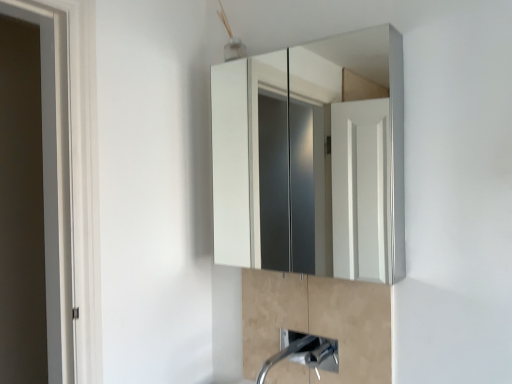
Describe the element at coordinates (304, 353) in the screenshot. I see `satin nickel faucet at lower center` at that location.

Locate an element on the screen. The height and width of the screenshot is (384, 512). satin nickel faucet at lower center is located at coordinates (304, 353).

What is the approximate height of satin nickel faucet at lower center?

The height of satin nickel faucet at lower center is 14.05 inches.

Image resolution: width=512 pixels, height=384 pixels. I want to click on satin nickel faucet at lower center, so click(x=304, y=353).

You are a GUI agent. You are given a task and a screenshot of the screen. Output one action in this format:
    pyautogui.click(x=<x>, y=<y>)
    Task: Click on the plumbing fixture lying below the white glossy medicine cabinet at upper center (from the image's perspective)
    This screenshot has width=512, height=384.
    Given the screenshot: What is the action you would take?
    pyautogui.click(x=304, y=353)

Is white glossy medicine cabinet at upper center oriented away from satin nickel faucet at lower center?

No, white glossy medicine cabinet at upper center's orientation is not away from satin nickel faucet at lower center.

Is point (355, 234) closer or farther from the camera than point (329, 358)?

Point (355, 234).

Do you think white glossy medicine cabinet at upper center is within satin nickel faucet at lower center, or outside of it?

white glossy medicine cabinet at upper center is outside satin nickel faucet at lower center.

Who is shorter, satin nickel faucet at lower center or white glossy medicine cabinet at upper center?

Standing shorter between the two is satin nickel faucet at lower center.

Identify the location of medicine cabinet above the satin nickel faucet at lower center (from the image's perspective). This screenshot has width=512, height=384. (311, 159).

Who is bigger, satin nickel faucet at lower center or white glossy medicine cabinet at upper center?

white glossy medicine cabinet at upper center is bigger.

From the image's perspective, who appears lower, satin nickel faucet at lower center or white glossy medicine cabinet at upper center?

From the image's view, satin nickel faucet at lower center is below.

Is satin nickel faucet at lower center to the left of satin nickel faucet at lower center from the viewer's perspective?

Indeed, satin nickel faucet at lower center is positioned on the left side of satin nickel faucet at lower center.

Does satin nickel faucet at lower center contain satin nickel faucet at lower center?

No.

Could you tell me if satin nickel faucet at lower center is facing satin nickel faucet at lower center?

No, satin nickel faucet at lower center is not turned towards satin nickel faucet at lower center.

Considering the sizes of satin nickel faucet at lower center and satin nickel faucet at lower center in the image, is satin nickel faucet at lower center bigger or smaller than satin nickel faucet at lower center?

Considering their sizes, satin nickel faucet at lower center takes up more space than satin nickel faucet at lower center.

Based on the photo, is satin nickel faucet at lower center bigger than satin nickel faucet at lower center?

Incorrect, satin nickel faucet at lower center is not larger than satin nickel faucet at lower center.

From the image's perspective, is satin nickel faucet at lower center positioned above or below satin nickel faucet at lower center?

Based on their image positions, satin nickel faucet at lower center is located above satin nickel faucet at lower center.

How far apart are satin nickel faucet at lower center and satin nickel faucet at lower center?

A distance of 3.28 inches exists between satin nickel faucet at lower center and satin nickel faucet at lower center.

Are satin nickel faucet at lower center and satin nickel faucet at lower center beside each other?

Yes, satin nickel faucet at lower center is touching satin nickel faucet at lower center.

Measure the distance from satin nickel faucet at lower center to white glossy medicine cabinet at upper center.

satin nickel faucet at lower center is 25.97 inches away from white glossy medicine cabinet at upper center.

Which point is more distant from viewer, (248, 273) or (269, 170)?

The point (269, 170) is farther.

Can you see satin nickel faucet at lower center touching white glossy medicine cabinet at upper center?

They are not placed beside each other.

Between satin nickel faucet at lower center and white glossy medicine cabinet at upper center, which one has smaller size?

Smaller between the two is satin nickel faucet at lower center.

Between white glossy medicine cabinet at upper center and satin nickel faucet at lower center, which one has less height?

satin nickel faucet at lower center.

From a real-world perspective, which is physically below, white glossy medicine cabinet at upper center or satin nickel faucet at lower center?

In real-world perspective, satin nickel faucet at lower center is lower.

From the image's perspective, which object appears higher, white glossy medicine cabinet at upper center or satin nickel faucet at lower center?

white glossy medicine cabinet at upper center appears higher in the image.

Could you measure the distance between white glossy medicine cabinet at upper center and satin nickel faucet at lower center?

They are 65.97 centimeters apart.

Locate an element on the screen. The width and height of the screenshot is (512, 384). medicine cabinet in front of the satin nickel faucet at lower center is located at coordinates (311, 159).

Identify the location of plumbing fixture below the white glossy medicine cabinet at upper center (from the image's perspective). The image size is (512, 384). (304, 353).

From the picture: Which object lies nearer to the anchor point white glossy medicine cabinet at upper center, satin nickel faucet at lower center or satin nickel faucet at lower center?

satin nickel faucet at lower center is closer to white glossy medicine cabinet at upper center.

From the image, which object appears to be farther from satin nickel faucet at lower center, white glossy medicine cabinet at upper center or satin nickel faucet at lower center?

The object further to satin nickel faucet at lower center is white glossy medicine cabinet at upper center.

Looking at the image, which one is located further to satin nickel faucet at lower center, satin nickel faucet at lower center or white glossy medicine cabinet at upper center?

Among the two, white glossy medicine cabinet at upper center is located further to satin nickel faucet at lower center.

Consider the image. Which object lies nearer to the anchor point satin nickel faucet at lower center, white glossy medicine cabinet at upper center or satin nickel faucet at lower center?

Based on the image, satin nickel faucet at lower center appears to be nearer to satin nickel faucet at lower center.

Considering their positions, is satin nickel faucet at lower center positioned further to white glossy medicine cabinet at upper center than satin nickel faucet at lower center?

Among the two, satin nickel faucet at lower center is located further to white glossy medicine cabinet at upper center.

Considering their positions, is satin nickel faucet at lower center positioned further to satin nickel faucet at lower center than white glossy medicine cabinet at upper center?

The object further to satin nickel faucet at lower center is white glossy medicine cabinet at upper center.

Find the location of a particular element. cabinetry that lies between white glossy medicine cabinet at upper center and satin nickel faucet at lower center from top to bottom is located at coordinates (316, 325).